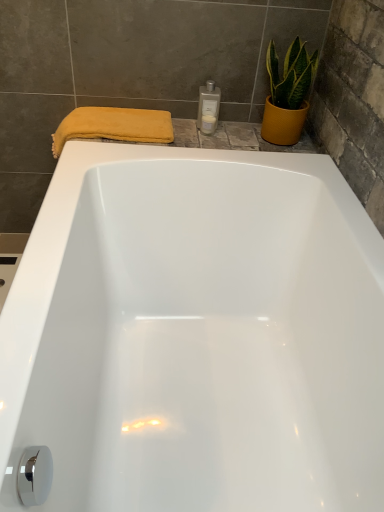
Where is `vacant space situated above yellow soft towel at upper left (from a real-world perspective)`? This screenshot has height=512, width=384. vacant space situated above yellow soft towel at upper left (from a real-world perspective) is located at coordinates (112, 115).